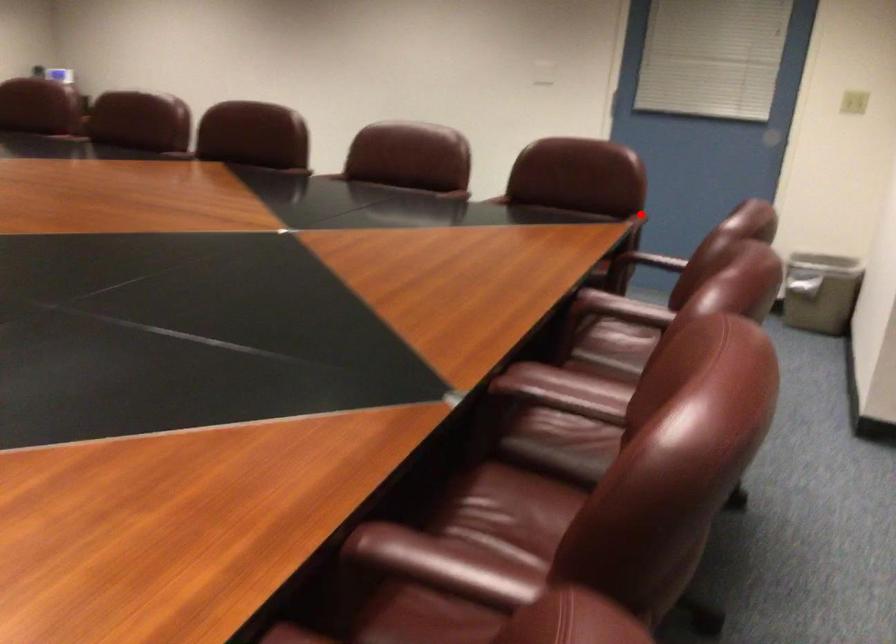
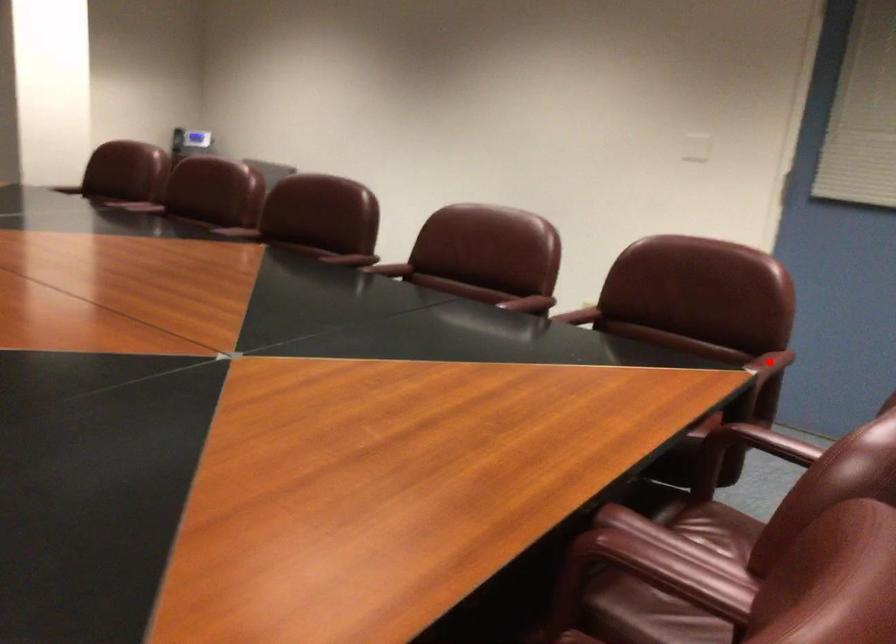
I am providing you with two images of the same scene from different viewpoints. A red point is marked on the first image and another point is marked on the second image. Do the highlighted points in image1 and image2 indicate the same real-world spot?

Yes